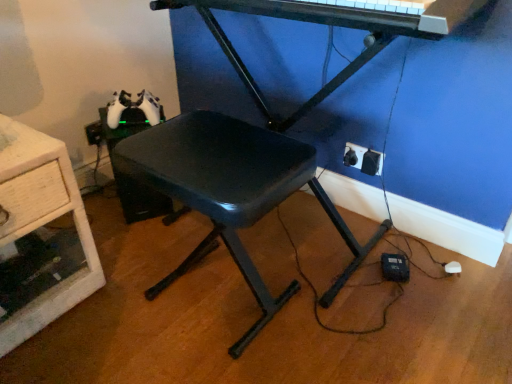
Where is `wooden drawer at left`? The image size is (512, 384). wooden drawer at left is located at coordinates (40, 235).

In order to face metallic black piano at upper center, should I rotate leftwards or rightwards?

Rotate your view right by about 10.092°.

What do you see at coordinates (362, 159) in the screenshot? The image size is (512, 384). I see `black plastic electric outlet at lower right, which ranks as the 2th electric outlet in front-to-back order` at bounding box center [362, 159].

Where is `black plastic electric outlet at lower right, which ranks as the 2th electric outlet in front-to-back order`? black plastic electric outlet at lower right, which ranks as the 2th electric outlet in front-to-back order is located at coordinates (362, 159).

This screenshot has height=384, width=512. What do you see at coordinates (372, 163) in the screenshot?
I see `black plastic electric outlet at lower right, which appears as the 2th electric outlet when viewed from the back` at bounding box center [372, 163].

What is the approximate height of black plastic electric outlet at lower right, which appears as the 2th electric outlet when viewed from the back?

It is 3.34 inches.

At what (x,y) coordinates should I click in order to perform the action: click on wooden drawer at left. Please return your answer as a coordinate pair (x, y). This screenshot has height=384, width=512. Looking at the image, I should click on (40, 235).

Considering the sizes of objects metallic black piano at upper center and black plastic stool at center in the image provided, who is bigger, metallic black piano at upper center or black plastic stool at center?

Bigger between the two is black plastic stool at center.

Is metallic black piano at upper center at the left side of black plastic stool at center?

In fact, metallic black piano at upper center is to the right of black plastic stool at center.

Do you think metallic black piano at upper center is within black plastic stool at center, or outside of it?

The correct answer is: outside.

From a real-world perspective, is metallic black piano at upper center located beneath black plastic stool at center?

No, from a real-world perspective, metallic black piano at upper center is not beneath black plastic stool at center.

Is metallic black piano at upper center surrounded by wooden drawer at left?

Actually, metallic black piano at upper center is outside wooden drawer at left.

Who is more distant, wooden drawer at left or metallic black piano at upper center?

wooden drawer at left is behind.

Is wooden drawer at left oriented away from metallic black piano at upper center?

No.

Considering the points (18, 140) and (395, 13), which point is in front, point (18, 140) or point (395, 13)?

Positioned in front is point (395, 13).

Based on the photo, can you confirm if black plastic electric outlet at lower right, which appears as the 2th electric outlet when viewed from the back, is positioned to the left of wooden drawer at left?

In fact, black plastic electric outlet at lower right, which appears as the 2th electric outlet when viewed from the back, is to the right of wooden drawer at left.

The width and height of the screenshot is (512, 384). Identify the location of electric outlet that is the 1st object located behind the wooden drawer at left. pyautogui.click(x=372, y=163).

Between black plastic electric outlet at lower right, which is the 1th electric outlet from front to back, and wooden drawer at left, which one has less height?

Standing shorter between the two is black plastic electric outlet at lower right, which is the 1th electric outlet from front to back.

Would you say black plastic electric outlet at lower right, which appears as the 2th electric outlet when viewed from the back, is outside wooden drawer at left?

Yes.

From a real-world perspective, is metallic black piano at upper center under black plastic electric outlet at lower right, which is the 1th electric outlet from front to back?

Actually, metallic black piano at upper center is physically above black plastic electric outlet at lower right, which is the 1th electric outlet from front to back, in the real world.

Considering the points (257, 7) and (373, 156), which point is in front, point (257, 7) or point (373, 156)?

The point (257, 7) is more forward.

Does metallic black piano at upper center turn towards black plastic electric outlet at lower right, which appears as the 2th electric outlet when viewed from the back?

No, metallic black piano at upper center is not oriented towards black plastic electric outlet at lower right, which appears as the 2th electric outlet when viewed from the back.

Does metallic black piano at upper center touch black plastic electric outlet at lower right, which ranks as the 2th electric outlet in front-to-back order?

No, metallic black piano at upper center is not in contact with black plastic electric outlet at lower right, which ranks as the 2th electric outlet in front-to-back order.

In terms of size, does metallic black piano at upper center appear bigger or smaller than black plastic electric outlet at lower right, which ranks as the 2th electric outlet in front-to-back order?

metallic black piano at upper center is bigger than black plastic electric outlet at lower right, which ranks as the 2th electric outlet in front-to-back order.

Is metallic black piano at upper center located outside black plastic electric outlet at lower right, which ranks as the 2th electric outlet in front-to-back order?

Yes, metallic black piano at upper center is not within black plastic electric outlet at lower right, which ranks as the 2th electric outlet in front-to-back order.

Is metallic black piano at upper center closer to camera compared to black plastic electric outlet at lower right, which ranks as the 2th electric outlet in front-to-back order?

Yes, metallic black piano at upper center is closer to the viewer.

Can you confirm if black plastic electric outlet at lower right, which appears as the 2th electric outlet when viewed from the back, is smaller than black plastic electric outlet at lower right, which is the 1th electric outlet from back to front?

Incorrect, black plastic electric outlet at lower right, which appears as the 2th electric outlet when viewed from the back, is not smaller in size than black plastic electric outlet at lower right, which is the 1th electric outlet from back to front.

Is black plastic electric outlet at lower right, which appears as the 2th electric outlet when viewed from the back, shorter than black plastic electric outlet at lower right, which ranks as the 2th electric outlet in front-to-back order?

Yes, black plastic electric outlet at lower right, which appears as the 2th electric outlet when viewed from the back, is shorter than black plastic electric outlet at lower right, which ranks as the 2th electric outlet in front-to-back order.

Where is `electric outlet lying above the black plastic electric outlet at lower right, which appears as the 2th electric outlet when viewed from the back (from the image's perspective)`? This screenshot has height=384, width=512. electric outlet lying above the black plastic electric outlet at lower right, which appears as the 2th electric outlet when viewed from the back (from the image's perspective) is located at coordinates (362, 159).

Is black plastic electric outlet at lower right, which appears as the 2th electric outlet when viewed from the back, to the right of black plastic electric outlet at lower right, which is the 1th electric outlet from back to front, from the viewer's perspective?

Yes.

Are black plastic electric outlet at lower right, which ranks as the 2th electric outlet in front-to-back order, and black plastic stool at center located far from each other?

No.

Which object is further away from the camera taking this photo, black plastic electric outlet at lower right, which is the 1th electric outlet from back to front, or black plastic stool at center?

black plastic electric outlet at lower right, which is the 1th electric outlet from back to front, is further away from the camera.

Is black plastic electric outlet at lower right, which ranks as the 2th electric outlet in front-to-back order, completely or partially outside of black plastic stool at center?

Yes.

In the image, there is a metallic black piano at upper center. Find the location of `stool below it (from the image's perspective)`. stool below it (from the image's perspective) is located at coordinates (231, 191).

The image size is (512, 384). I want to click on piano on the right of wooden drawer at left, so click(x=353, y=13).

Estimate the real-world distances between objects in this image. Which object is further from black plastic stool at center, black plastic electric outlet at lower right, which appears as the 2th electric outlet when viewed from the back, or wooden drawer at left?

black plastic electric outlet at lower right, which appears as the 2th electric outlet when viewed from the back, is further to black plastic stool at center.

Which object lies further to the anchor point black plastic electric outlet at lower right, which appears as the 2th electric outlet when viewed from the back, wooden drawer at left or black plastic stool at center?

The object further to black plastic electric outlet at lower right, which appears as the 2th electric outlet when viewed from the back, is wooden drawer at left.

Based on their spatial positions, is black plastic stool at center or metallic black piano at upper center further from black plastic electric outlet at lower right, which ranks as the 2th electric outlet in front-to-back order?

The object further to black plastic electric outlet at lower right, which ranks as the 2th electric outlet in front-to-back order, is metallic black piano at upper center.

Consider the image. Looking at the image, which one is located further to black plastic electric outlet at lower right, which is the 1th electric outlet from front to back, black plastic stool at center or wooden drawer at left?

wooden drawer at left lies further to black plastic electric outlet at lower right, which is the 1th electric outlet from front to back, than the other object.

Based on their spatial positions, is metallic black piano at upper center or black plastic stool at center further from wooden drawer at left?

Based on the image, metallic black piano at upper center appears to be further to wooden drawer at left.

Consider the image. Which object lies further to the anchor point metallic black piano at upper center, black plastic electric outlet at lower right, which is the 1th electric outlet from front to back, or black plastic stool at center?

black plastic electric outlet at lower right, which is the 1th electric outlet from front to back, is positioned further to the anchor metallic black piano at upper center.

Considering their positions, is black plastic stool at center positioned closer to black plastic electric outlet at lower right, which is the 1th electric outlet from back to front, than black plastic electric outlet at lower right, which appears as the 2th electric outlet when viewed from the back?

Among the two, black plastic electric outlet at lower right, which appears as the 2th electric outlet when viewed from the back, is located nearer to black plastic electric outlet at lower right, which is the 1th electric outlet from back to front.

From the picture: Considering their positions, is black plastic electric outlet at lower right, which is the 1th electric outlet from back to front, positioned closer to metallic black piano at upper center than black plastic electric outlet at lower right, which appears as the 2th electric outlet when viewed from the back?

Among the two, black plastic electric outlet at lower right, which is the 1th electric outlet from back to front, is located nearer to metallic black piano at upper center.

This screenshot has height=384, width=512. I want to click on stool between wooden drawer at left and black plastic electric outlet at lower right, which appears as the 2th electric outlet when viewed from the back, so click(x=231, y=191).

The width and height of the screenshot is (512, 384). Identify the location of electric outlet between black plastic stool at center and black plastic electric outlet at lower right, which is the 1th electric outlet from back to front, in the front-back direction. (372, 163).

The height and width of the screenshot is (384, 512). Find the location of `stool between wooden drawer at left and metallic black piano at upper center in the horizontal direction`. stool between wooden drawer at left and metallic black piano at upper center in the horizontal direction is located at coordinates (231, 191).

This screenshot has width=512, height=384. Identify the location of piano between black plastic stool at center and black plastic electric outlet at lower right, which appears as the 2th electric outlet when viewed from the back, along the z-axis. (353, 13).